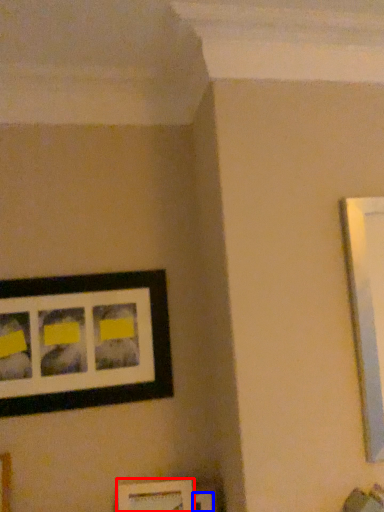
Question: Which point is closer to the camera, picture frame (highlighted by a red box) or picture frame (highlighted by a blue box)?

Choices:
 (A) picture frame
 (B) picture frame

Answer: (A)